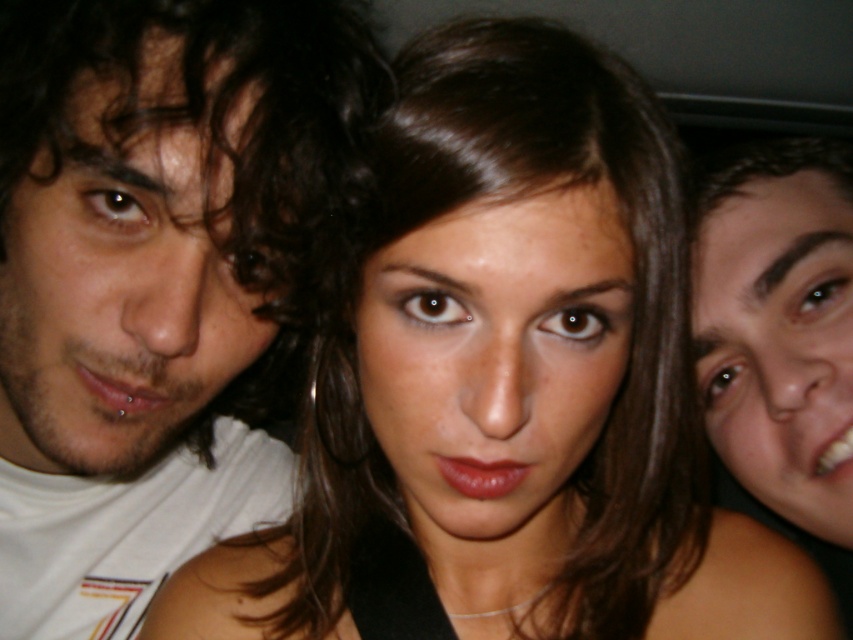
Question: Is smooth skin face at center to the left of matte skin face at right from the viewer's perspective?

Choices:
 (A) no
 (B) yes

Answer: (B)

Question: Which of the following is the farthest from the observer?

Choices:
 (A) matte skin face at right
 (B) smooth skin face at center

Answer: (A)

Question: Estimate the real-world distances between objects in this image. Which object is farther from the smooth skin face at left?

Choices:
 (A) smooth skin face at center
 (B) matte skin face at right

Answer: (B)

Question: Among these points, which one is nearest to the camera?

Choices:
 (A) (747, 204)
 (B) (51, 204)
 (C) (560, 342)

Answer: (C)

Question: Does smooth skin face at center have a lesser width compared to matte skin face at right?

Choices:
 (A) no
 (B) yes

Answer: (A)

Question: Is smooth skin face at left positioned before matte skin face at right?

Choices:
 (A) yes
 (B) no

Answer: (A)